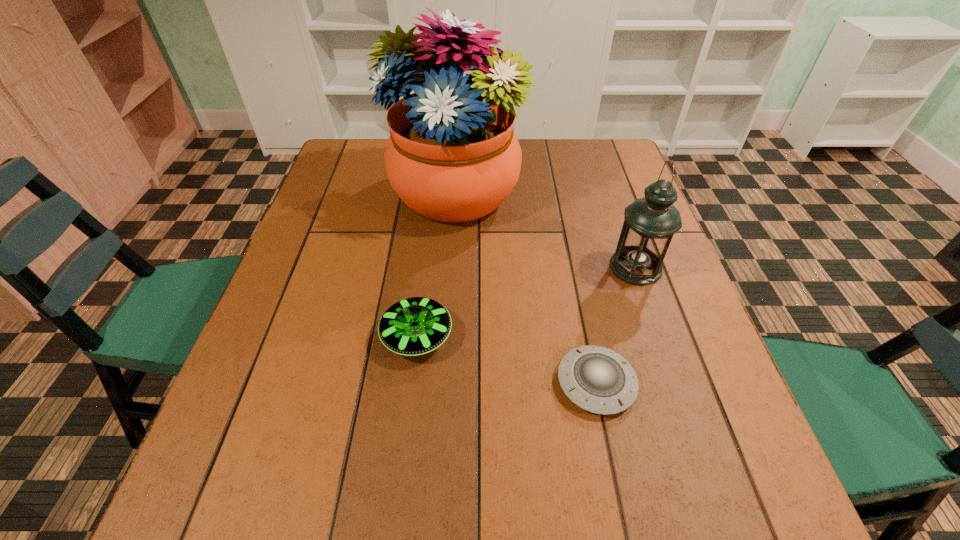
I want to click on the farthest object, so click(x=452, y=156).

Find the location of a particular element. The image size is (960, 540). the tallest object is located at coordinates (452, 156).

This screenshot has width=960, height=540. I want to click on the second farthest object, so click(650, 222).

At what (x,y) coordinates should I click in order to perform the action: click on oil lamp. Please return your answer as a coordinate pair (x, y). The height and width of the screenshot is (540, 960). Looking at the image, I should click on (650, 222).

What are the coordinates of `the taller saucer` in the screenshot? It's located at (414, 326).

Identify the location of the left saucer. (414, 326).

You are a GUI agent. You are given a task and a screenshot of the screen. Output one action in this format:
    pyautogui.click(x=<x>, y=<y>)
    Task: Click on the shortest object
    The height and width of the screenshot is (540, 960).
    Given the screenshot: What is the action you would take?
    pyautogui.click(x=597, y=379)

The width and height of the screenshot is (960, 540). Find the location of `the right saucer`. the right saucer is located at coordinates (597, 379).

The image size is (960, 540). In order to click on vacant area situated 0.370m on the front of the tallest object in this screenshot , I will do `click(444, 370)`.

At what (x,y) coordinates should I click in order to perform the action: click on free space located on the left of the third shortest object. Please return your answer as a coordinate pair (x, y). Looking at the image, I should click on (567, 267).